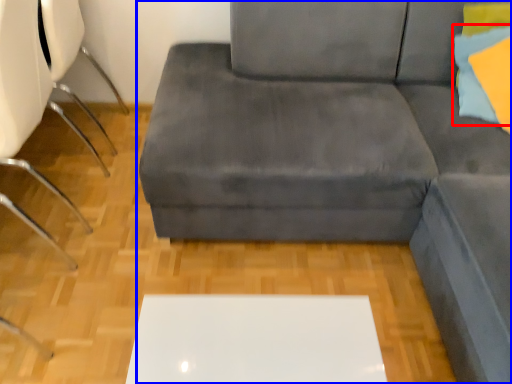
Question: Among these objects, which one is farthest to the camera, pillow (highlighted by a red box) or studio couch (highlighted by a blue box)?

Choices:
 (A) pillow
 (B) studio couch

Answer: (B)